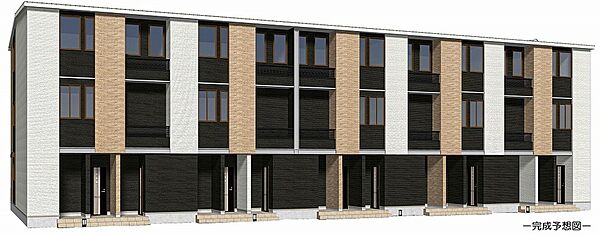
At what (x,y) coordinates should I click in order to perform the action: click on pillar. Please return your answer as a coordinate pair (x, y). Image resolution: width=600 pixels, height=235 pixels. Looking at the image, I should click on (115, 195), (244, 186), (335, 189), (443, 193), (526, 189).